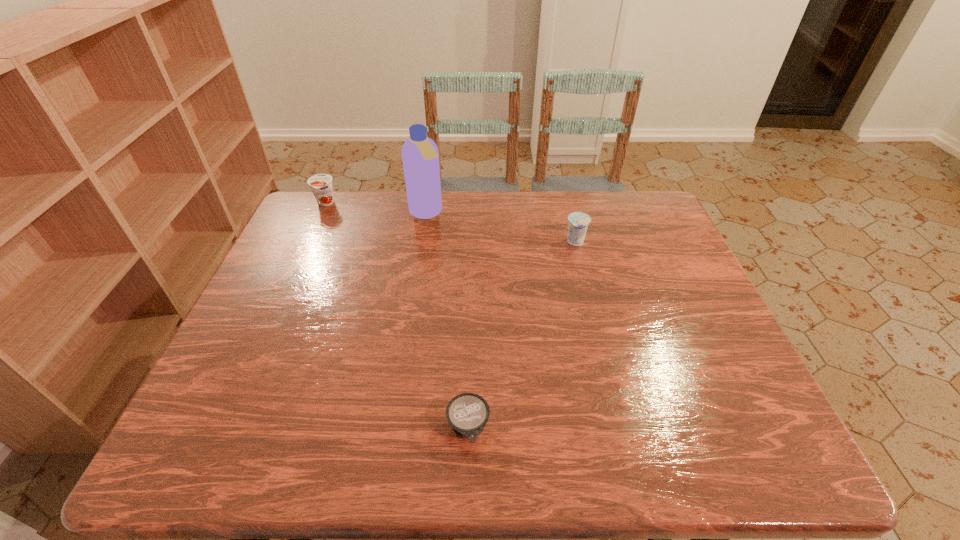
Where is `free region located 0.220m on the left of the second nearest object`? This screenshot has width=960, height=540. free region located 0.220m on the left of the second nearest object is located at coordinates (489, 242).

The width and height of the screenshot is (960, 540). What are the coordinates of `vacant space situated 0.280m on the right of the second yogurt from right to left` in the screenshot? It's located at (634, 428).

The height and width of the screenshot is (540, 960). In order to click on shampoo at the far edge in this screenshot , I will do `click(420, 156)`.

I want to click on object at the near edge, so click(467, 413).

You are a GUI agent. You are given a task and a screenshot of the screen. Output one action in this format:
    pyautogui.click(x=<x>, y=<y>)
    Task: Click on the object at the left edge
    The height and width of the screenshot is (540, 960).
    Given the screenshot: What is the action you would take?
    pyautogui.click(x=321, y=184)

Locate an element on the screen. object at the far left corner is located at coordinates (321, 184).

Where is `free space at the far edge of the desktop`? free space at the far edge of the desktop is located at coordinates tap(599, 197).

Find the location of a particular element. free space at the left edge is located at coordinates (324, 249).

Where is `free space at the right edge of the desktop`? The image size is (960, 540). free space at the right edge of the desktop is located at coordinates (699, 409).

Identify the location of free space at the far left corner of the desktop. The width and height of the screenshot is (960, 540). (325, 206).